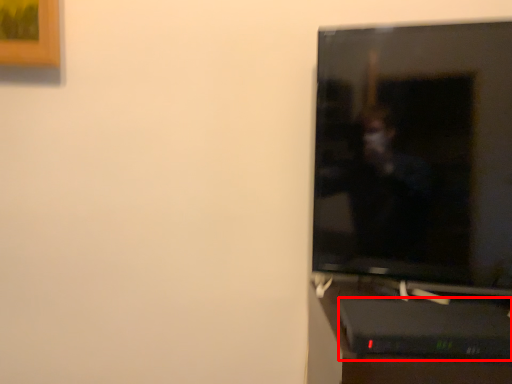
Question: From the image's perspective, what is the correct spatial relationship of computer desk (annotated by the red box) in relation to television?

Choices:
 (A) above
 (B) below

Answer: (B)